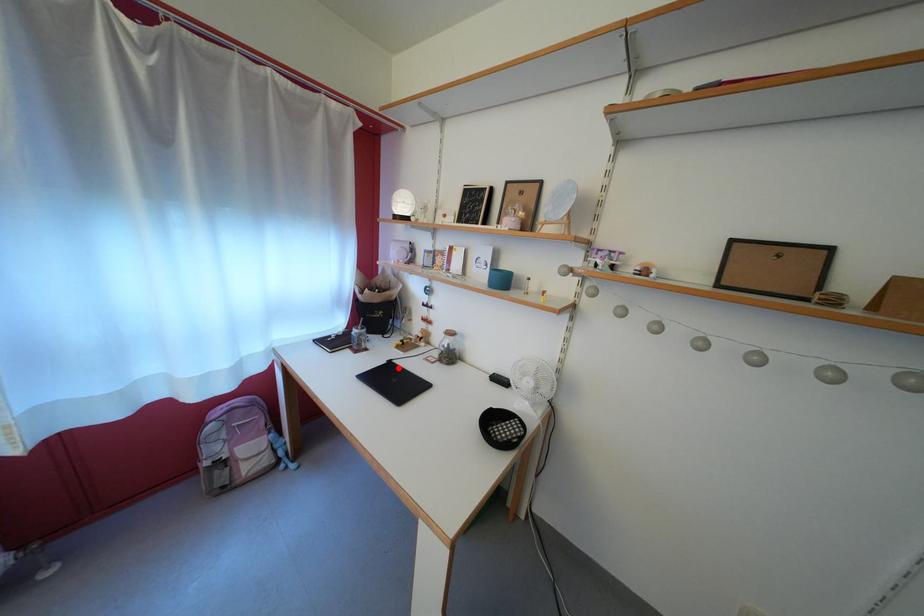
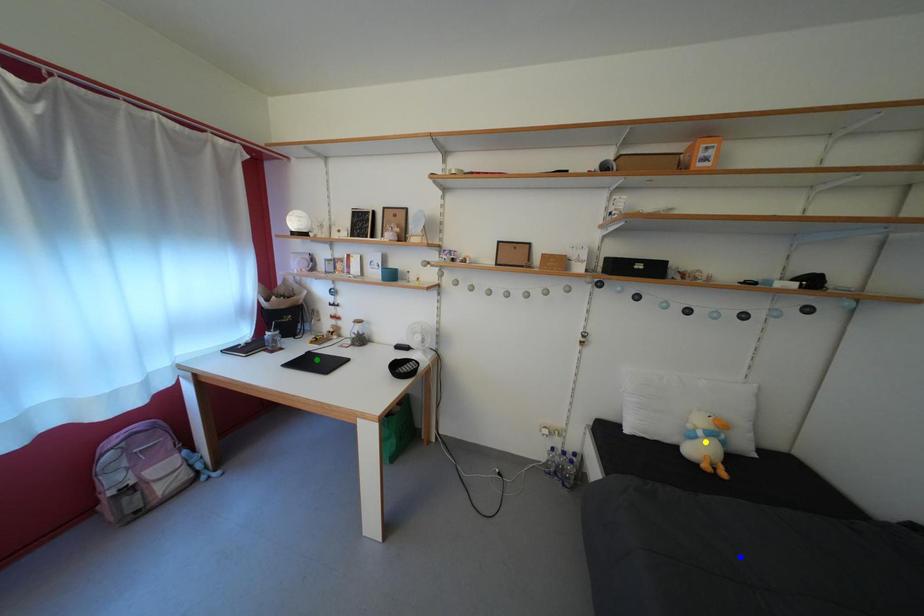
Question: I am providing you with two images of the same scene from different viewpoints. A red point is marked on the first image. You are given multiple points on the second image. Which point in image 2 represents the same 3d spot as the red point in image 1?

Choices:
 (A) blue point
 (B) yellow point
 (C) green point

Answer: (C)